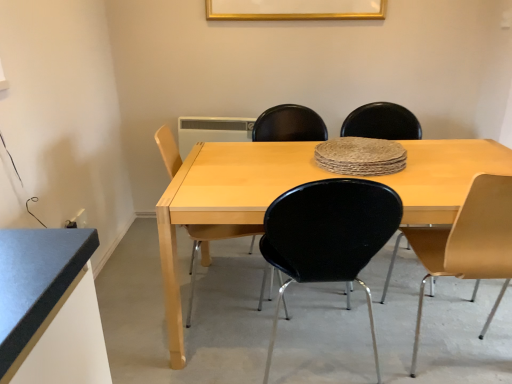
This screenshot has width=512, height=384. Identify the location of free area below light wood table at center (from a real-world perspective). (325, 306).